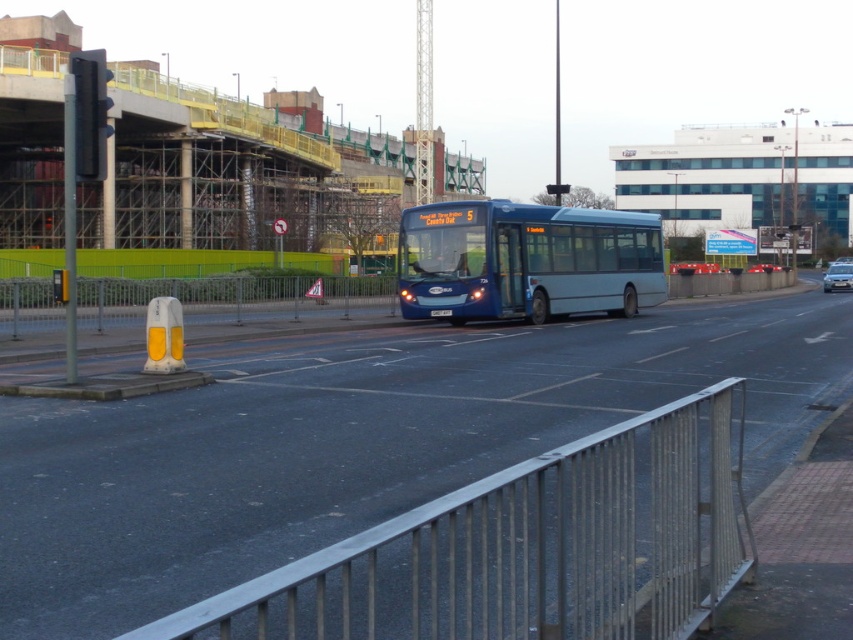
You are a delivery person standing at the point marked as point (x=529, y=547). What object is directly in front of you?

The silver metallic rail at lower center is directly in front of you at point (x=529, y=547).

You are a pedestrian trying to cross the road safely. You see the silver metallic rail at lower center and the matte blue bus at center. Which object is closer to the road surface?

The silver metallic rail at lower center is positioned under the matte blue bus at center, meaning it is closer to the road surface than the bus.

You are standing at the point marked by the coordinates [529,547] in the image. What object is exactly at this location?

The silver metallic rail at lower center is located at point [529,547].